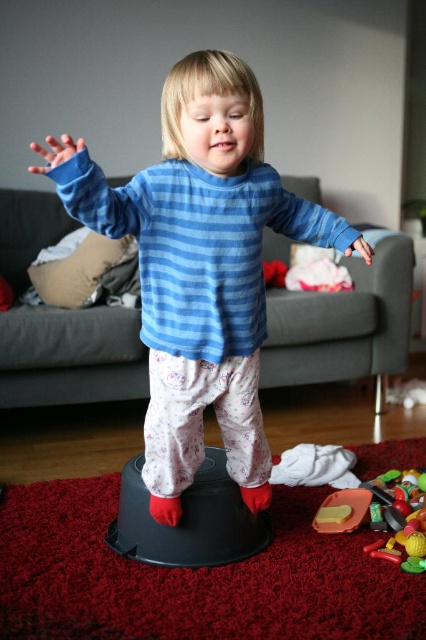
You are a parent looking for your child to put away their toys. You see the blue striped sweater at center and the rubberized plastic toy at lower right. Which object should your child place to the left side first?

The child should place the blue striped sweater at center first because it is already positioned to the left of the rubberized plastic toy at lower right, so placing it to the left makes sense.

You are a parent trying to organize your child. The blue striped sweater at center and the rubberized plastic toy at lower right are in the image. How far apart are these two items?

The blue striped sweater at center is 61.06 centimeters from the rubberized plastic toy at lower right.

You are a parent trying to find your child a warm sweater. The child is standing on a black plastic stool on a red shaggy rug. You see a blue striped sweater at center at point (199, 266). Is the blue striped sweater at center within reach of the child?

The blue striped sweater at center is located at point (199, 266). Since the child is standing on a black plastic stool, they can likely reach items at that point, so yes, the blue striped sweater at center is within reach.